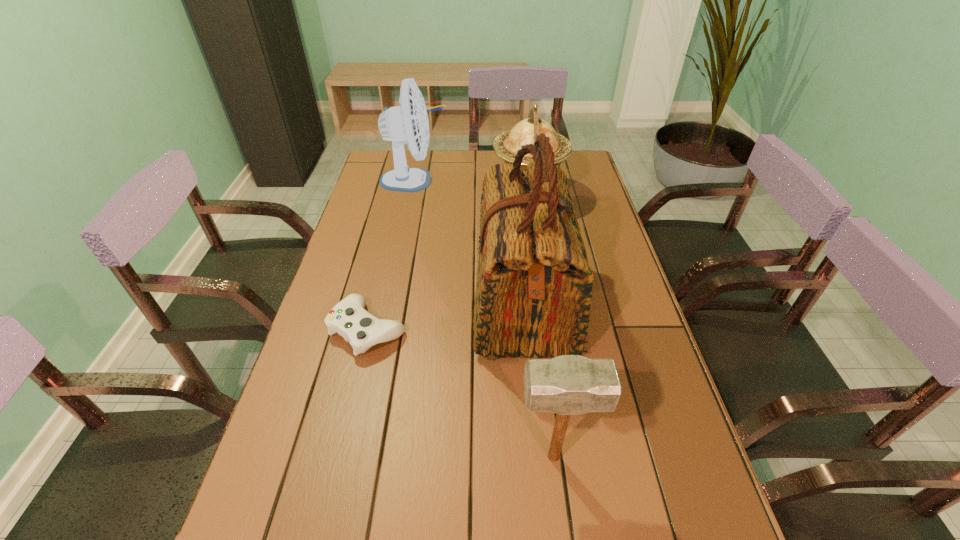
Locate an element on the screen. The image size is (960, 540). the tallest object is located at coordinates (533, 293).

Locate an element on the screen. This screenshot has width=960, height=540. fan is located at coordinates (408, 123).

This screenshot has height=540, width=960. I want to click on globe, so click(x=506, y=145).

Find the location of `mallet`. mallet is located at coordinates (567, 385).

I want to click on the shortest object, so click(x=348, y=318).

At what (x,y) coordinates should I click in order to perform the action: click on vacant space located 0.160m on the open handle side of the shopping bag. Please return your answer as a coordinate pair (x, y). The width and height of the screenshot is (960, 540). Looking at the image, I should click on (412, 302).

I want to click on vacant region located 0.250m on the open handle side of the shopping bag, so click(x=379, y=302).

Find the location of `vacant position located on the open handle side of the shopping bag`. vacant position located on the open handle side of the shopping bag is located at coordinates [x=427, y=302].

The width and height of the screenshot is (960, 540). I want to click on vacant space located on the grille of the fan, so click(473, 180).

I want to click on free space located on the front-facing side of the globe, so click(403, 194).